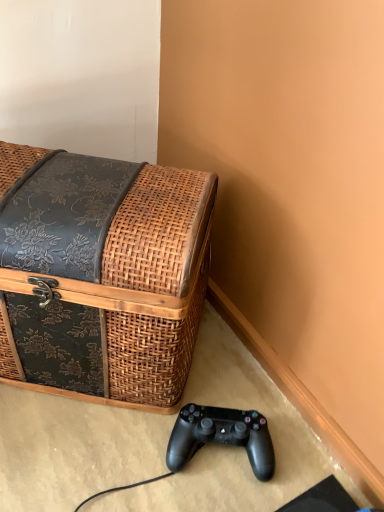
Image resolution: width=384 pixels, height=512 pixels. I want to click on woven wood trunk at left, so click(101, 274).

Describe the element at coordinates (101, 274) in the screenshot. I see `woven wood trunk at left` at that location.

You are a GUI agent. You are given a task and a screenshot of the screen. Output one action in this format:
    pyautogui.click(x=<x>, y=<y>)
    Task: Click on the black matte game controller at lower center
    The height and width of the screenshot is (512, 384).
    Given the screenshot: What is the action you would take?
    221,436

What do you see at coordinates (221, 436) in the screenshot?
I see `black matte game controller at lower center` at bounding box center [221, 436].

At what (x,y) coordinates should I click in order to perform the action: click on woven wood trunk at left. Please return your answer as a coordinate pair (x, y). Looking at the image, I should click on (101, 274).

Based on the photo, would you say black matte game controller at lower center is to the left or to the right of woven wood trunk at left in the picture?

In the image, black matte game controller at lower center appears on the right side of woven wood trunk at left.

Which object is closer to the camera, black matte game controller at lower center or woven wood trunk at left?

woven wood trunk at left is closer to the camera.

Is point (223, 432) closer to viewer compared to point (132, 277)?

That is False.

From the image's perspective, between black matte game controller at lower center and woven wood trunk at left, which one is located above?

woven wood trunk at left, from the image's perspective.

From a real-world perspective, between black matte game controller at lower center and woven wood trunk at left, who is vertically higher?

woven wood trunk at left, from a real-world perspective.

Can you confirm if black matte game controller at lower center is wider than woven wood trunk at left?

No, black matte game controller at lower center is not wider than woven wood trunk at left.

Can you confirm if black matte game controller at lower center is taller than woven wood trunk at left?

Incorrect, the height of black matte game controller at lower center is not larger of that of woven wood trunk at left.

Considering the sizes of black matte game controller at lower center and woven wood trunk at left in the image, is black matte game controller at lower center bigger or smaller than woven wood trunk at left?

In the image, black matte game controller at lower center appears to be smaller than woven wood trunk at left.

Is black matte game controller at lower center surrounding woven wood trunk at left?

No, woven wood trunk at left is not a part of black matte game controller at lower center.

Is black matte game controller at lower center far from woven wood trunk at left?

No, black matte game controller at lower center is in close proximity to woven wood trunk at left.

Is black matte game controller at lower center oriented towards woven wood trunk at left?

No, black matte game controller at lower center is not aimed at woven wood trunk at left.

What's the angular difference between black matte game controller at lower center and woven wood trunk at left's facing directions?

A: There is a 3.29-degree angle between the facing directions of black matte game controller at lower center and woven wood trunk at left.

Locate an element on the screen. The image size is (384, 512). game controller that is on the right side of woven wood trunk at left is located at coordinates (221, 436).

Which object is positioned more to the left, woven wood trunk at left or black matte game controller at lower center?

woven wood trunk at left.

Is woven wood trunk at left closer to the viewer compared to black matte game controller at lower center?

Yes, woven wood trunk at left is in front of black matte game controller at lower center.

Is point (141, 329) positioned before point (184, 411)?

Yes, point (141, 329) is closer to viewer.

From the image's perspective, is woven wood trunk at left under black matte game controller at lower center?

No.

From a real-world perspective, is woven wood trunk at left physically located above or below black matte game controller at lower center?

woven wood trunk at left is above black matte game controller at lower center.

Which object is thinner, woven wood trunk at left or black matte game controller at lower center?

With smaller width is black matte game controller at lower center.

Which of these two, woven wood trunk at left or black matte game controller at lower center, stands taller?

woven wood trunk at left is taller.

Is woven wood trunk at left bigger or smaller than black matte game controller at lower center?

Considering their sizes, woven wood trunk at left takes up more space than black matte game controller at lower center.

Would you say woven wood trunk at left contains black matte game controller at lower center?

No, woven wood trunk at left does not contain black matte game controller at lower center.

Is woven wood trunk at left positioned far away from black matte game controller at lower center?

woven wood trunk at left is near black matte game controller at lower center, not far away.

In the scene shown: Is woven wood trunk at left aimed at black matte game controller at lower center?

No, woven wood trunk at left is not oriented towards black matte game controller at lower center.

How distant is woven wood trunk at left from black matte game controller at lower center?

woven wood trunk at left and black matte game controller at lower center are 24.88 centimeters apart from each other.

What are the coordinates of `furniture in front of the black matte game controller at lower center` in the screenshot? It's located at (101, 274).

Where is `furniture on the left of black matte game controller at lower center`? This screenshot has width=384, height=512. furniture on the left of black matte game controller at lower center is located at coordinates click(101, 274).

You are a GUI agent. You are given a task and a screenshot of the screen. Output one action in this format:
    pyautogui.click(x=<x>, y=<y>)
    Task: Click on the game controller on the right of woven wood trunk at left
    
    Given the screenshot: What is the action you would take?
    pyautogui.click(x=221, y=436)